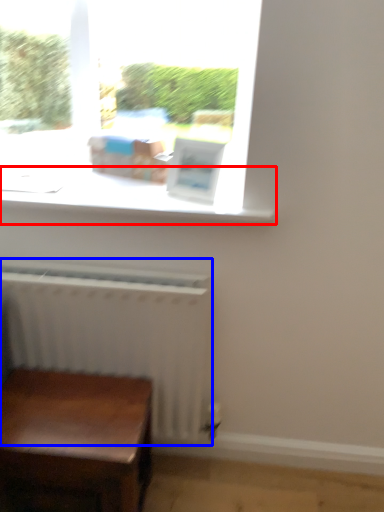
Question: Among these objects, which one is farthest to the camera, window sill (highlighted by a red box) or radiator (highlighted by a blue box)?

Choices:
 (A) window sill
 (B) radiator

Answer: (B)